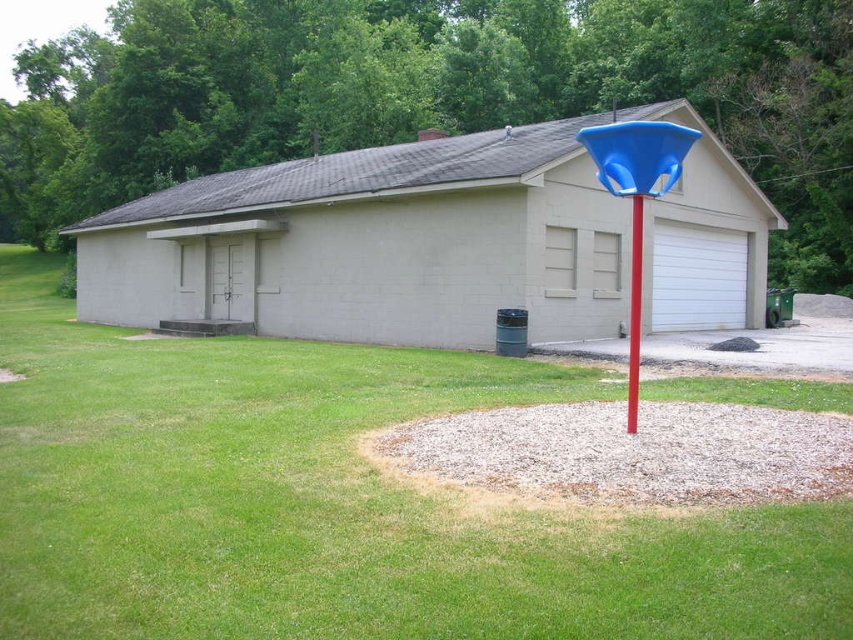
Question: Which point appears farthest from the camera in this image?

Choices:
 (A) (285, 182)
 (B) (627, 608)

Answer: (A)

Question: Which point is farther to the camera?

Choices:
 (A) matte concrete garage at center
 (B) blue plastic pole at center

Answer: (A)

Question: Which object is positioned farthest from the matte concrete garage at center?

Choices:
 (A) blue plastic pole at center
 (B) green grass at center

Answer: (A)

Question: Can you confirm if matte concrete garage at center is positioned to the right of blue plastic pole at center?

Choices:
 (A) yes
 (B) no

Answer: (B)

Question: Does green grass at center have a lesser width compared to blue plastic pole at center?

Choices:
 (A) no
 (B) yes

Answer: (A)

Question: Does matte concrete garage at center appear over blue plastic pole at center?

Choices:
 (A) no
 (B) yes

Answer: (B)